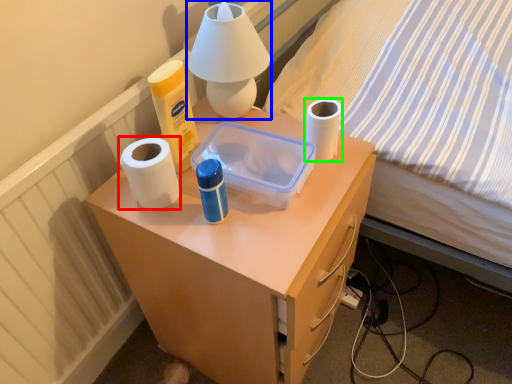
Question: Which object is the farthest from paper towel (highlighted by a red box)? Choose among these: table lamp (highlighted by a blue box) or toilet paper (highlighted by a green box).

Choices:
 (A) table lamp
 (B) toilet paper

Answer: (B)